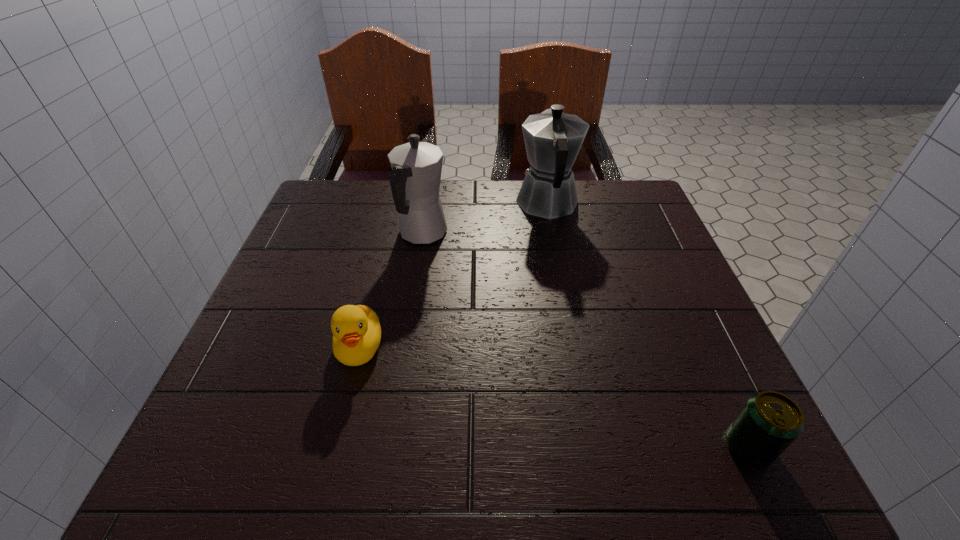
In order to click on vacant point located between the nearest object and the second nearest object in this screenshot , I will do `click(554, 397)`.

You are a GUI agent. You are given a task and a screenshot of the screen. Output one action in this format:
    pyautogui.click(x=<x>, y=<y>)
    Task: Click on the vacant area that lies between the right coffeepot and the third farthest object
    This screenshot has width=960, height=540.
    Given the screenshot: What is the action you would take?
    pyautogui.click(x=453, y=275)

Where is `vacant region between the second nearest object and the third object from left to right`? This screenshot has width=960, height=540. vacant region between the second nearest object and the third object from left to right is located at coordinates (453, 275).

This screenshot has width=960, height=540. Identify the location of free space between the second nearest object and the nearest object. (554, 397).

You are a GUI agent. You are given a task and a screenshot of the screen. Output one action in this format:
    pyautogui.click(x=<x>, y=<y>)
    Task: Click on the vacant space that's between the right coffeepot and the duck
    This screenshot has height=540, width=960.
    Given the screenshot: What is the action you would take?
    pyautogui.click(x=453, y=275)

The width and height of the screenshot is (960, 540). In order to click on vacant area that lies between the second object from right to left and the left coffeepot in this screenshot , I will do `click(486, 219)`.

At what (x,y) coordinates should I click in order to perform the action: click on vacant area that lies between the duck and the nearest object. Please return your answer as a coordinate pair (x, y). This screenshot has height=540, width=960. Looking at the image, I should click on (554, 397).

Identify the location of unoccupied position between the second nearest object and the right coffeepot. (453, 275).

Image resolution: width=960 pixels, height=540 pixels. Find the location of `the third closest object relative to the left coffeepot`. the third closest object relative to the left coffeepot is located at coordinates (769, 422).

Image resolution: width=960 pixels, height=540 pixels. I want to click on the third closest object to the third farthest object, so click(769, 422).